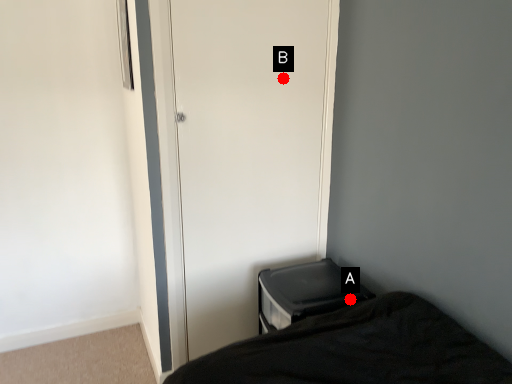
Question: Two points are circled on the image, labeled by A and B beside each circle. Which point is closer to the camera?

Choices:
 (A) A is closer
 (B) B is closer

Answer: (A)